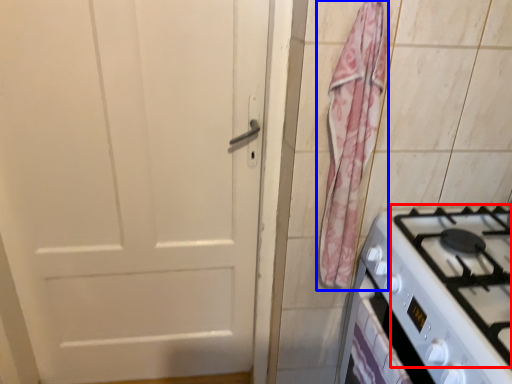
Question: Among these objects, which one is nearest to the camera, gas stove (highlighted by a red box) or curtain (highlighted by a blue box)?

Choices:
 (A) gas stove
 (B) curtain

Answer: (A)